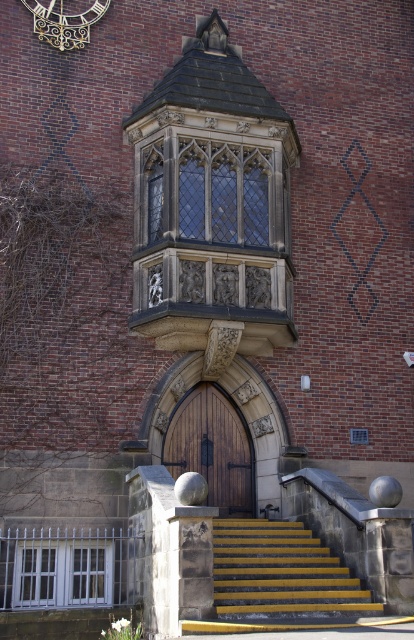
Does white glass window at lower left lie in front of gold metallic clock at upper left?

That is True.

Does white glass window at lower left appear on the right side of gold metallic clock at upper left?

Correct, you'll find white glass window at lower left to the right of gold metallic clock at upper left.

Does point (31, 605) come in front of point (41, 35)?

Yes, it is.

Locate an element on the screen. This screenshot has width=414, height=640. white glass window at lower left is located at coordinates (62, 572).

Does clear glass window at center appear on the left side of yellow painted concrete stairs at center?

Correct, you'll find clear glass window at center to the left of yellow painted concrete stairs at center.

Image resolution: width=414 pixels, height=640 pixels. I want to click on clear glass window at center, so click(x=209, y=192).

Between yellow painted concrete stairs at center and white glass window at lower left, which one is positioned higher?

Positioned higher is yellow painted concrete stairs at center.

Who is positioned more to the right, yellow painted concrete stairs at center or white glass window at lower left?

From the viewer's perspective, yellow painted concrete stairs at center appears more on the right side.

This screenshot has height=640, width=414. What are the coordinates of `yellow painted concrete stairs at center` in the screenshot? It's located at (281, 573).